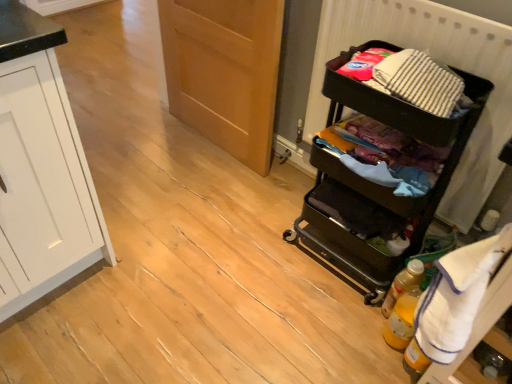
Find the location of a particular element. Image resolution: width=512 pixels, height=384 pixels. vacant position to the left of black plastic cart at right is located at coordinates (263, 244).